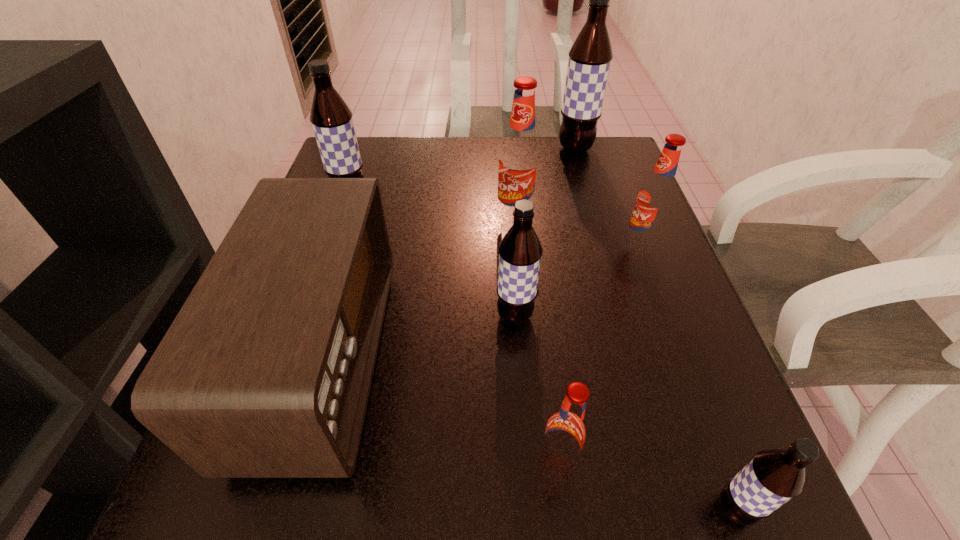
I want to click on the farthest object, so click(590, 56).

At what (x,y) coordinates should I click in order to perform the action: click on the biggest brown root beer. Please return your answer as a coordinate pair (x, y). This screenshot has width=960, height=540. Looking at the image, I should click on (590, 56).

Where is `the farthest red root beer`? Image resolution: width=960 pixels, height=540 pixels. the farthest red root beer is located at coordinates (520, 155).

Identify the location of the third smallest brown root beer. The height and width of the screenshot is (540, 960). (331, 118).

Identify the location of the third nearest brown root beer. (331, 118).

What are the coordinates of `the rightmost red root beer` in the screenshot? It's located at (656, 197).

Where is `the fourth nearest root beer`? This screenshot has height=540, width=960. the fourth nearest root beer is located at coordinates (656, 197).

The image size is (960, 540). Find the location of `the second smallest brown root beer`. the second smallest brown root beer is located at coordinates (520, 251).

In order to click on the third brown root beer from right to left in this screenshot , I will do `click(520, 251)`.

Image resolution: width=960 pixels, height=540 pixels. Find the location of `radio receiver`. radio receiver is located at coordinates (265, 372).